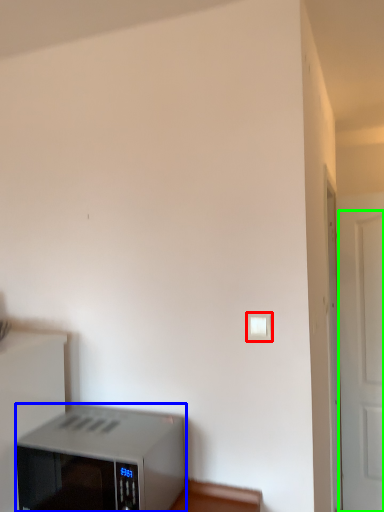
Question: Which object is the farthest from light switch (highlighted by a red box)? Choose among these: home appliance (highlighted by a blue box) or door (highlighted by a green box).

Choices:
 (A) home appliance
 (B) door

Answer: (B)